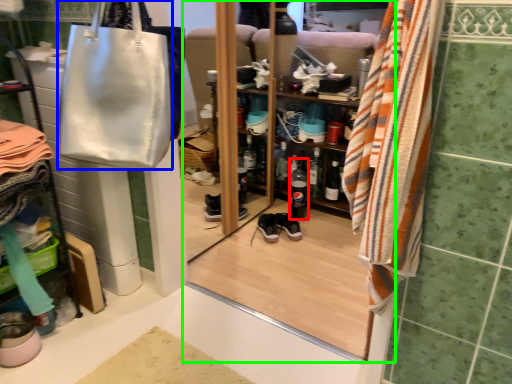
Question: Which object is positioned farthest from bottle (highlighted by a red box)? Select from handbag (highlighted by a blue box) and screen door (highlighted by a green box).

Choices:
 (A) handbag
 (B) screen door

Answer: (A)